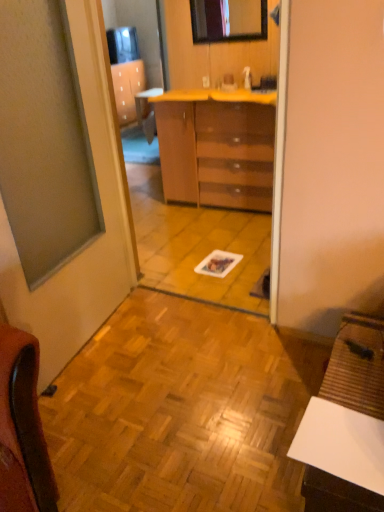
Question: From a real-world perspective, is wooden parquet floor at center located beneath yellow laminate counter at center?

Choices:
 (A) no
 (B) yes

Answer: (B)

Question: Is wooden parquet floor at center facing away from yellow laminate counter at center?

Choices:
 (A) yes
 (B) no

Answer: (B)

Question: Considering the relative sizes of wooden parquet floor at center and yellow laminate counter at center in the image provided, is wooden parquet floor at center wider than yellow laminate counter at center?

Choices:
 (A) no
 (B) yes

Answer: (B)

Question: Can you confirm if wooden parquet floor at center is shorter than yellow laminate counter at center?

Choices:
 (A) yes
 (B) no

Answer: (A)

Question: Is wooden parquet floor at center oriented towards yellow laminate counter at center?

Choices:
 (A) yes
 (B) no

Answer: (B)

Question: Is yellow laminate counter at center completely or partially inside wooden parquet floor at center?

Choices:
 (A) yes
 (B) no

Answer: (B)

Question: Considering the relative sizes of matte glass window at left and white matte desk at lower right in the image provided, is matte glass window at left shorter than white matte desk at lower right?

Choices:
 (A) no
 (B) yes

Answer: (A)

Question: From a real-world perspective, does matte glass window at left stand above white matte desk at lower right?

Choices:
 (A) yes
 (B) no

Answer: (A)

Question: Considering the relative sizes of matte glass window at left and white matte desk at lower right in the image provided, is matte glass window at left taller than white matte desk at lower right?

Choices:
 (A) yes
 (B) no

Answer: (A)

Question: Are matte glass window at left and white matte desk at lower right making contact?

Choices:
 (A) no
 (B) yes

Answer: (A)

Question: From a real-world perspective, does matte glass window at left sit lower than white matte desk at lower right?

Choices:
 (A) no
 (B) yes

Answer: (A)

Question: Is matte glass window at left wider than white matte desk at lower right?

Choices:
 (A) yes
 (B) no

Answer: (B)

Question: Is matte glass window at left located outside glossy brown chest of drawers at center?

Choices:
 (A) yes
 (B) no

Answer: (A)